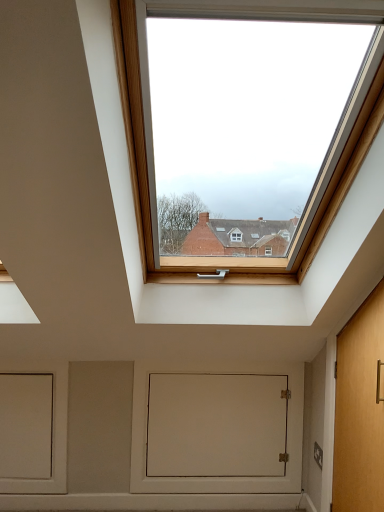
Identify the location of empty space that is ontop of white matte door at center. The height and width of the screenshot is (512, 384). (223, 361).